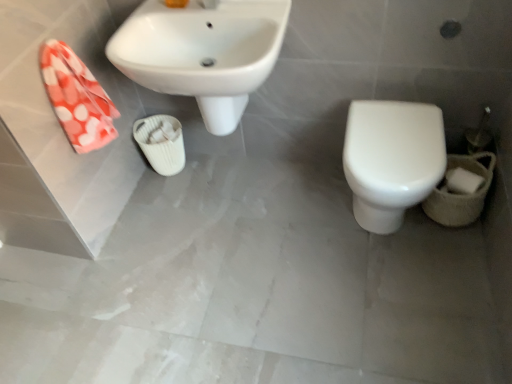
Where is `free spot below white glossy sink at upper left (from a real-world perspective)`? free spot below white glossy sink at upper left (from a real-world perspective) is located at coordinates pyautogui.click(x=233, y=190).